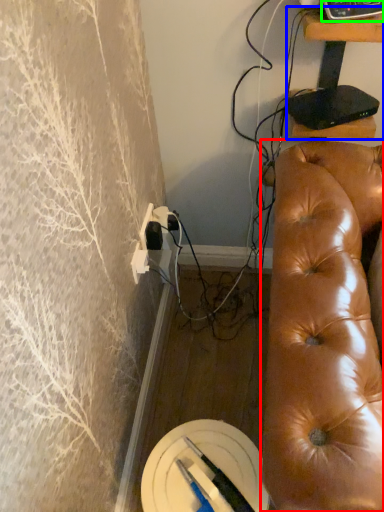
Question: Which object is the closest to the studio couch (highlighted by a red box)? Choose among these: furniture (highlighted by a blue box) or equipment (highlighted by a green box).

Choices:
 (A) furniture
 (B) equipment

Answer: (A)